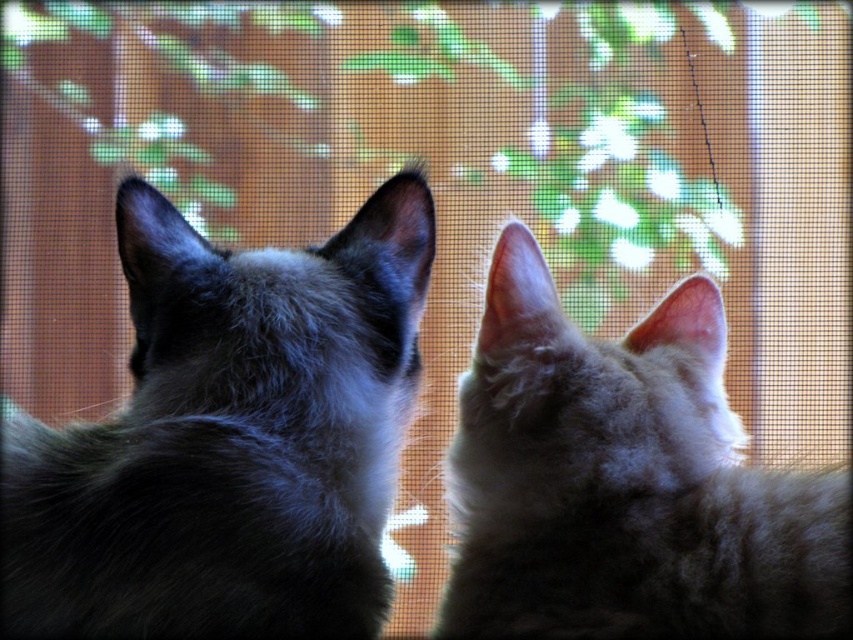
You are a small toy mouse that wants to roll between the silky black cat at left and the fuzzy gray cat at center. The toy mouse is 15 centimeters long. Do you think you can fit through the space between them?

The distance between the silky black cat at left and the fuzzy gray cat at center is 18.46 centimeters. Since the toy mouse is 15 centimeters long, it can fit through the space between them as the space is wider than the toy mouse.

You are a photographer trying to capture both the silky black cat at left and the fuzzy gray cat at center through the screen door. Since the screen door has a fine mesh texture, you need to ensure that both cats are in focus. Given their positions, which cat should you focus on to ensure both are sharp?

The silky black cat at left is located above the fuzzy gray cat at center. To ensure both are in focus, you should focus on the silky black cat at left as it is closer to the camera, and the depth of field will naturally include the lower cat in the background.

You are a cat owner trying to fit both your cats through a narrow cat door. The silky black cat at left is wider than the fuzzy gray cat at center. Which cat might have difficulty passing through first?

The silky black cat at left is wider than the fuzzy gray cat at center, so the silky black cat at left might have difficulty passing through the narrow cat door first because of its greater width.